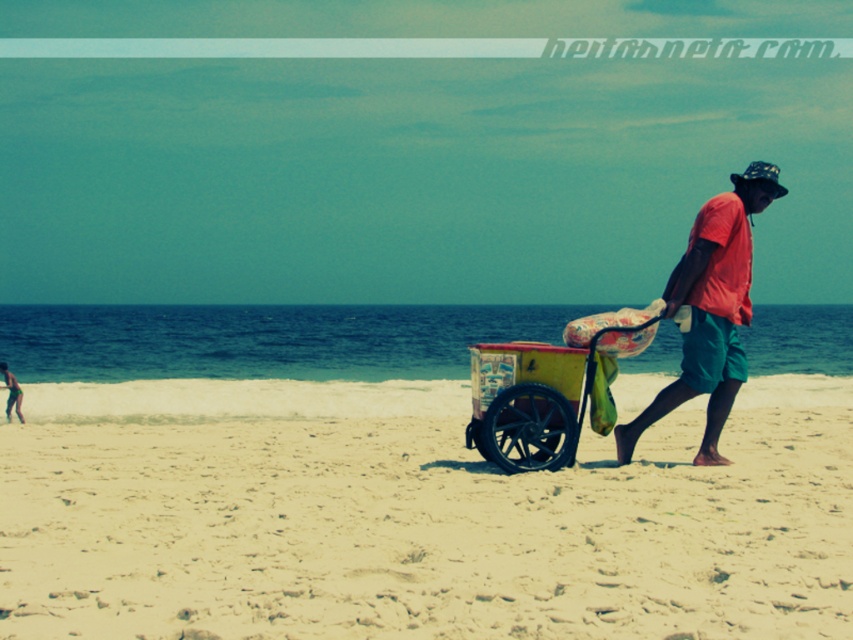
Does red cotton shirt at center appear over yellow painted wood cart at center?

Correct, red cotton shirt at center is located above yellow painted wood cart at center.

Can you confirm if red cotton shirt at center is positioned to the left of yellow painted wood cart at center?

Incorrect, red cotton shirt at center is not on the left side of yellow painted wood cart at center.

The image size is (853, 640). What do you see at coordinates (711, 308) in the screenshot?
I see `red cotton shirt at center` at bounding box center [711, 308].

This screenshot has width=853, height=640. What are the coordinates of `red cotton shirt at center` in the screenshot? It's located at (711, 308).

Between point (163, 493) and point (695, 296), which one is positioned behind?

The point (695, 296) is behind.

Is beige sandy beach at center positioned before red cotton shirt at center?

Yes, it is.

Between point (270, 577) and point (715, 296), which one is positioned behind?

Point (715, 296)

At what (x,y) coordinates should I click in order to perform the action: click on beige sandy beach at center. Please return your answer as a coordinate pair (x, y). The width and height of the screenshot is (853, 640). Looking at the image, I should click on point(415,516).

From the picture: Between beige sandy beach at center and yellow painted wood cart at center, which one is positioned lower?

beige sandy beach at center

Who is higher up, beige sandy beach at center or yellow painted wood cart at center?

Positioned higher is yellow painted wood cart at center.

Is point (535, 508) less distant than point (538, 372)?

Yes, it is in front of point (538, 372).

At what (x,y) coordinates should I click in order to perform the action: click on beige sandy beach at center. Please return your answer as a coordinate pair (x, y). Image resolution: width=853 pixels, height=640 pixels. Looking at the image, I should click on (415, 516).